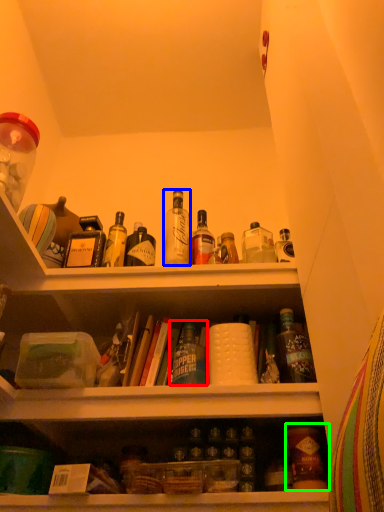
Question: Based on their relative distances, which object is farther from bottle (highlighted by a red box)? Choose from bottle (highlighted by a blue box) and bottle (highlighted by a green box).

Choices:
 (A) bottle
 (B) bottle

Answer: (A)